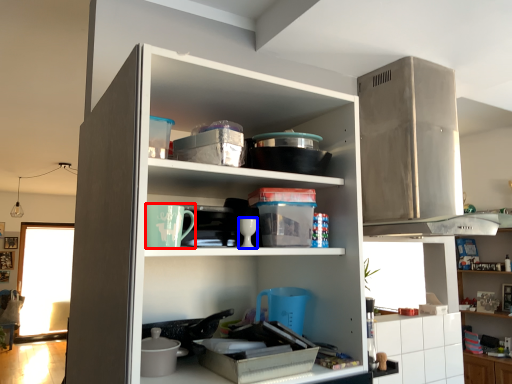
Question: Among these objects, which one is farthest to the camera, appliance (highlighted by a red box) or tableware (highlighted by a blue box)?

Choices:
 (A) appliance
 (B) tableware

Answer: (B)